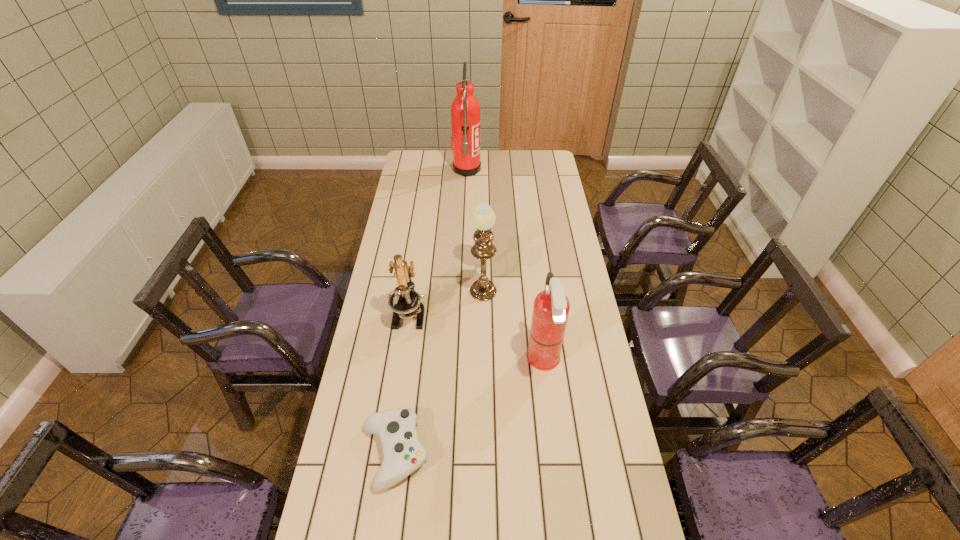
This screenshot has height=540, width=960. In order to click on vacant space that's between the microscope and the oil lamp in this screenshot , I will do `click(446, 298)`.

At what (x,y) coordinates should I click in order to perform the action: click on vacant space in between the microscope and the oil lamp. Please return your answer as a coordinate pair (x, y). Looking at the image, I should click on (446, 298).

Choose which object is the nearest neighbor to the nearer fire extinguisher. Please provide its 2D coordinates. Your answer should be formatted as a tuple, i.e. [(x, y)], where the tuple contains the x and y coordinates of a point satisfying the conditions above.

[(483, 218)]

Identify which object is the third nearest to the farther fire extinguisher. Please provide its 2D coordinates. Your answer should be formatted as a tuple, i.e. [(x, y)], where the tuple contains the x and y coordinates of a point satisfying the conditions above.

[(551, 307)]

The image size is (960, 540). Identify the location of free space that satisfies the following two spatial constraints: 1. on the back side of the oil lamp; 2. on the left side of the nearest object. (419, 281).